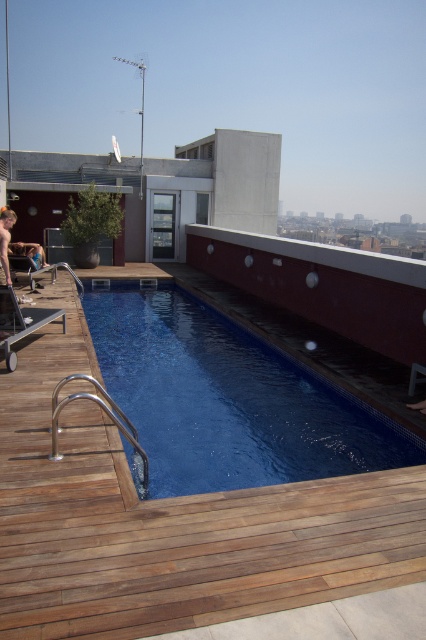
Is blue tile swimming pool at center smaller than silver metallic rail at lower left?

No.

Who is shorter, blue tile swimming pool at center or silver metallic rail at lower left?

Standing shorter between the two is silver metallic rail at lower left.

The image size is (426, 640). Describe the element at coordinates (227, 400) in the screenshot. I see `blue tile swimming pool at center` at that location.

You are a GUI agent. You are given a task and a screenshot of the screen. Output one action in this format:
    pyautogui.click(x=<x>, y=<y>)
    Task: Click on the blue tile swimming pool at center
    The height and width of the screenshot is (640, 426).
    Given the screenshot: What is the action you would take?
    pyautogui.click(x=227, y=400)

Is wooden deck at center thinner than blue tile swimming pool at center?

Yes.

Is wooden deck at center above blue tile swimming pool at center?

Actually, wooden deck at center is below blue tile swimming pool at center.

Between point (72, 529) and point (118, 392), which one is positioned behind?

The point (118, 392) is more distant.

I want to click on wooden deck at center, so click(x=169, y=522).

Which of these two, wooden deck at center or silver metallic rail at lower left, stands taller?

With more height is silver metallic rail at lower left.

Who is positioned more to the right, wooden deck at center or silver metallic rail at lower left?

wooden deck at center

Image resolution: width=426 pixels, height=640 pixels. Identify the location of wooden deck at center. (169, 522).

This screenshot has width=426, height=640. I want to click on wooden deck at center, so click(x=169, y=522).